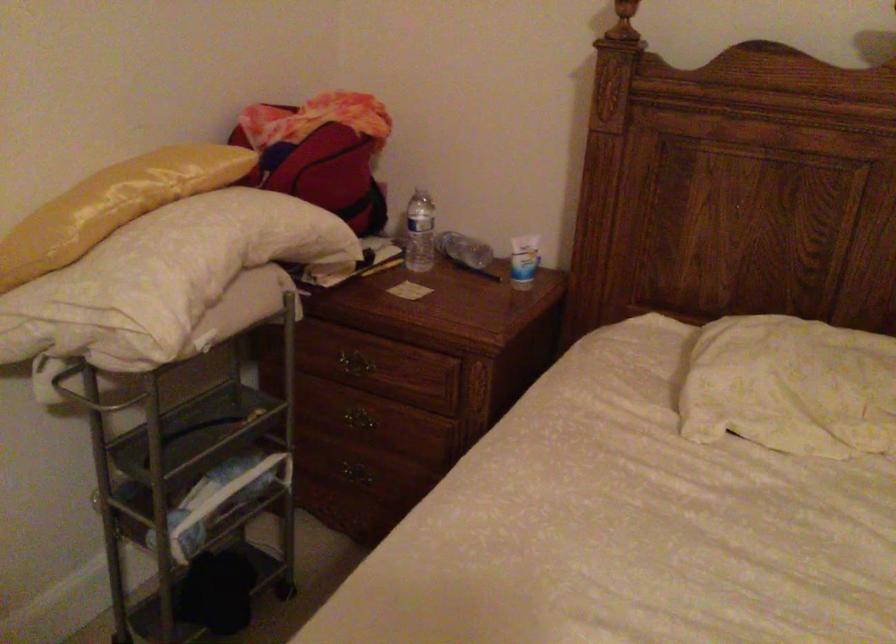
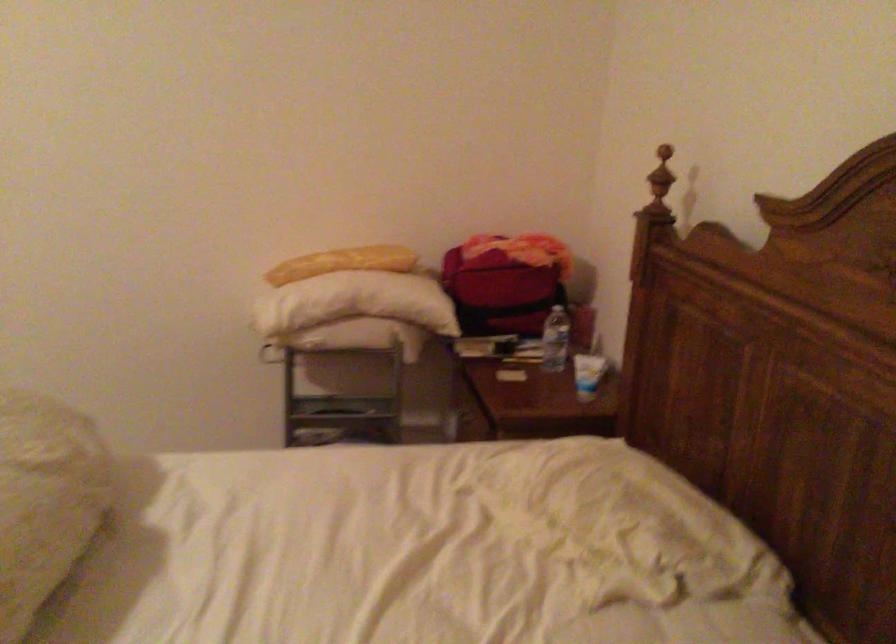
Locate, in the second image, the point that corresponds to pixel 364 169 in the first image.

(504, 281)